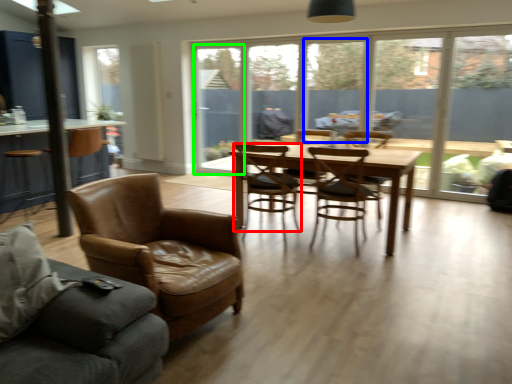
Question: Which object is the closest to the chair (highlighted by a red box)? Choose among these: window (highlighted by a blue box) or window screen (highlighted by a green box).

Choices:
 (A) window
 (B) window screen

Answer: (B)